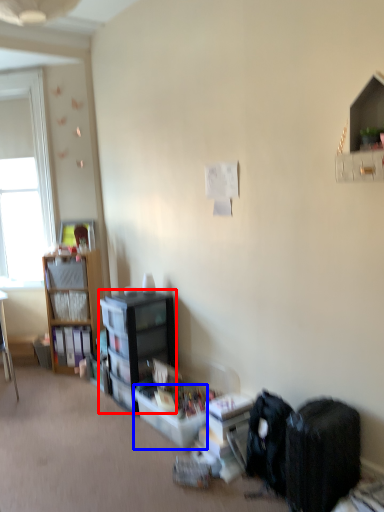
Question: Among these objects, which one is farthest to the camera, bookcase (highlighted by a red box) or storage box (highlighted by a blue box)?

Choices:
 (A) bookcase
 (B) storage box

Answer: (A)